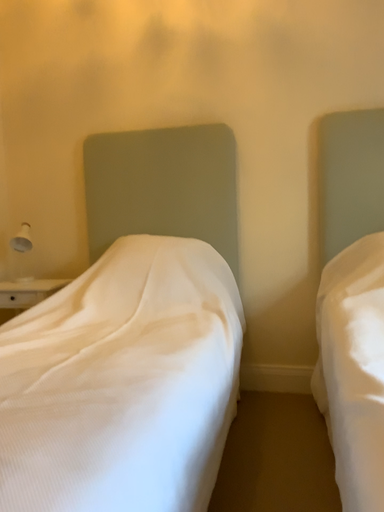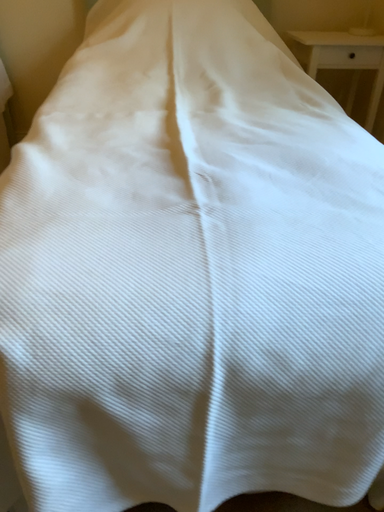
Question: Which way did the camera rotate in the video?

Choices:
 (A) rotated downward
 (B) rotated upward

Answer: (A)